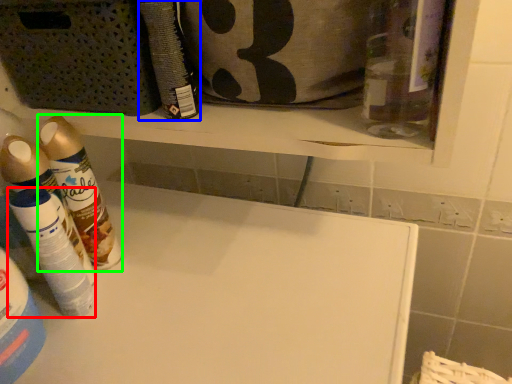
Question: Which object is positioned farthest from cleaning product (highlighted by a red box)? Select from cleaning product (highlighted by a blue box) and cleaning product (highlighted by a green box).

Choices:
 (A) cleaning product
 (B) cleaning product

Answer: (A)